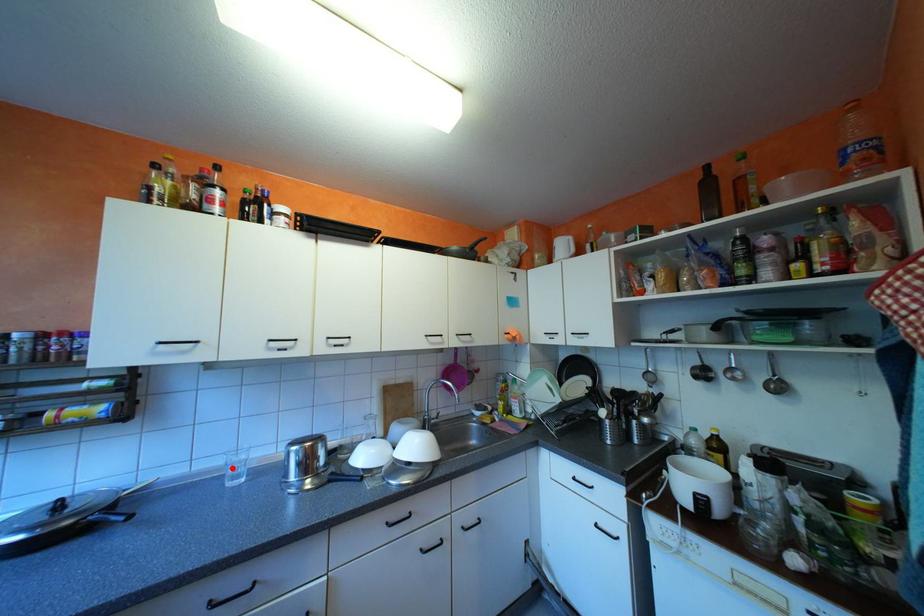
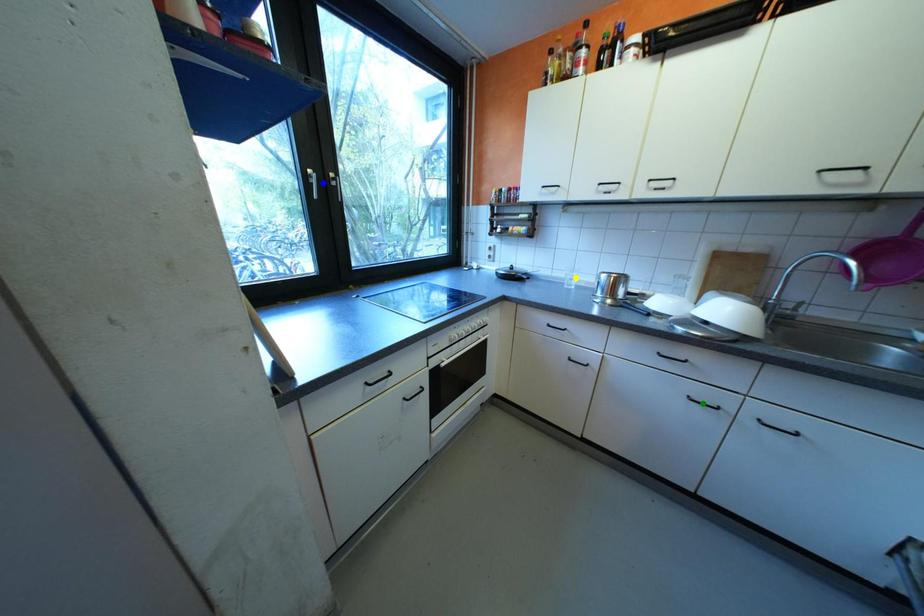
Question: I am providing you with two images of the same scene from different viewpoints. A red point is marked on the first image. You are given multiple points on the second image. Which mark in image 2 goes with the point in image 1?

Choices:
 (A) yellow point
 (B) blue point
 (C) green point

Answer: (A)